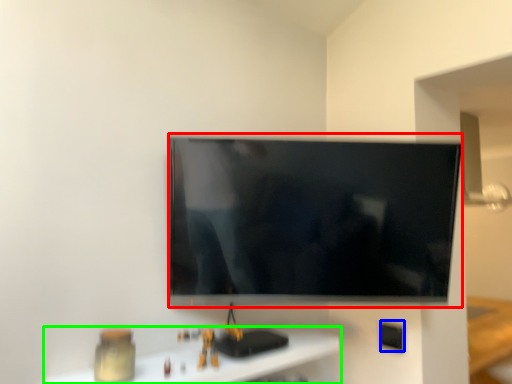
Question: Which object is the closest to the television (highlighted by a red box)? Choose among these: electric outlet (highlighted by a blue box) or furniture (highlighted by a green box).

Choices:
 (A) electric outlet
 (B) furniture

Answer: (B)